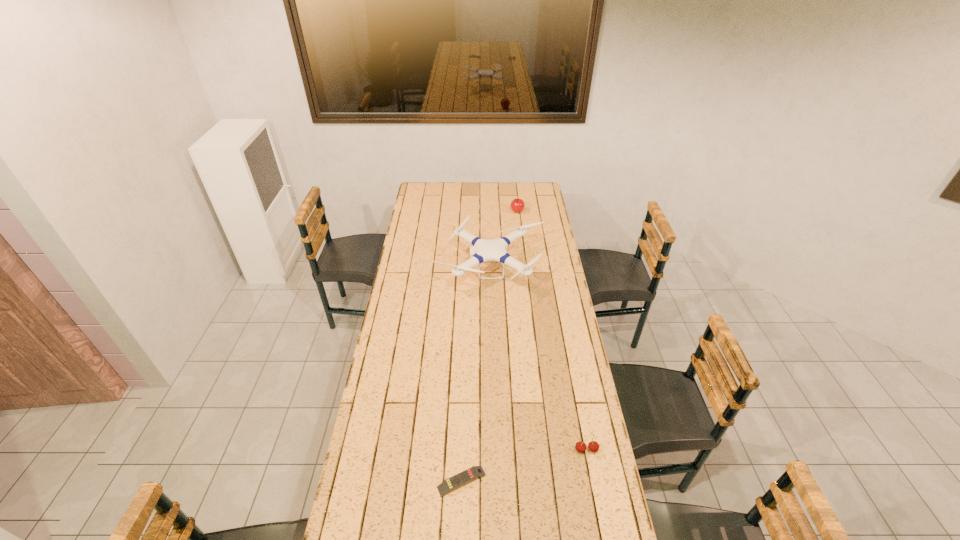
At what (x,y) coordinates should I click in order to perform the action: click on vacant space located on the surface of the nearer cherry. Please return your answer as a coordinate pair (x, y). The image size is (960, 540). Looking at the image, I should click on (595, 496).

The image size is (960, 540). In order to click on vacant space located 0.100m on the right of the remote control in this screenshot , I will do `click(517, 481)`.

Locate an element on the screen. This screenshot has height=540, width=960. drone at the right edge is located at coordinates (485, 250).

This screenshot has width=960, height=540. What are the coordinates of `vacant space at the far edge` in the screenshot? It's located at (512, 185).

Where is `free space at the left edge of the desktop`? The width and height of the screenshot is (960, 540). free space at the left edge of the desktop is located at coordinates (381, 422).

The height and width of the screenshot is (540, 960). In order to click on free spot at the right edge of the desktop in this screenshot , I will do `click(571, 349)`.

Image resolution: width=960 pixels, height=540 pixels. I want to click on vacant space at the far right corner of the desktop, so click(x=545, y=197).

Identify the location of free point between the farther cherry and the nearest object. This screenshot has width=960, height=540. (490, 347).

Find the location of a particular element. vacant area between the shortest object and the right cherry is located at coordinates 524,465.

You are a GUI agent. You are given a task and a screenshot of the screen. Output one action in this format:
    pyautogui.click(x=<x>, y=<y>)
    Task: Click on the unoccupied position between the left cherry and the second nearest object
    This screenshot has width=960, height=540.
    Given the screenshot: What is the action you would take?
    pyautogui.click(x=552, y=331)